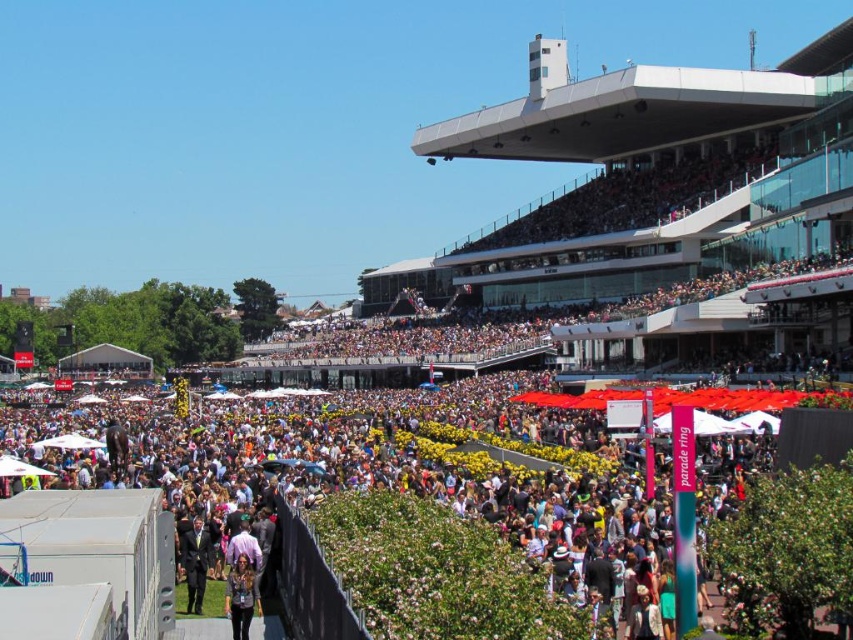
Who is taller, black suit at center or matte black jacket at lower center?

With more height is matte black jacket at lower center.

Find the location of a particular element. This screenshot has width=853, height=640. black suit at center is located at coordinates (195, 563).